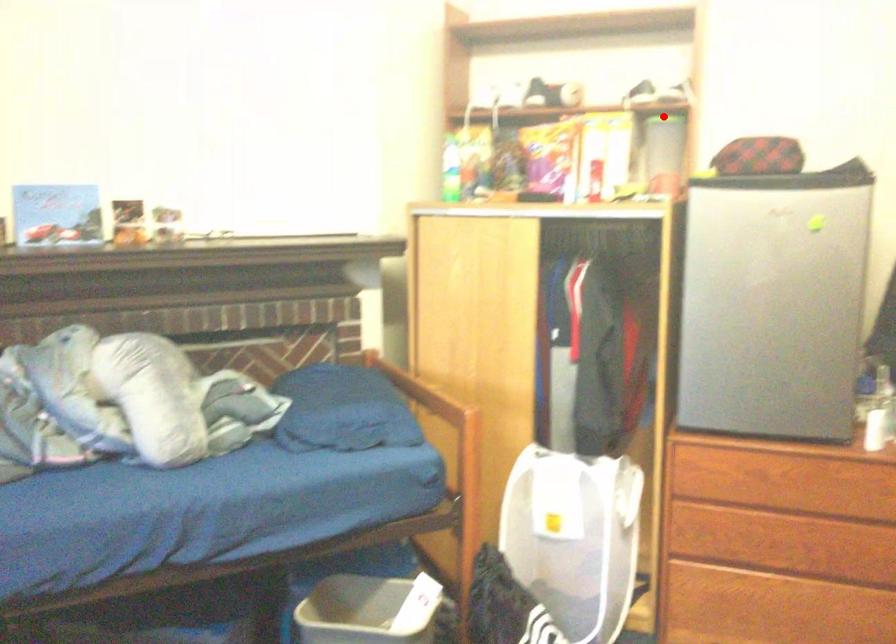
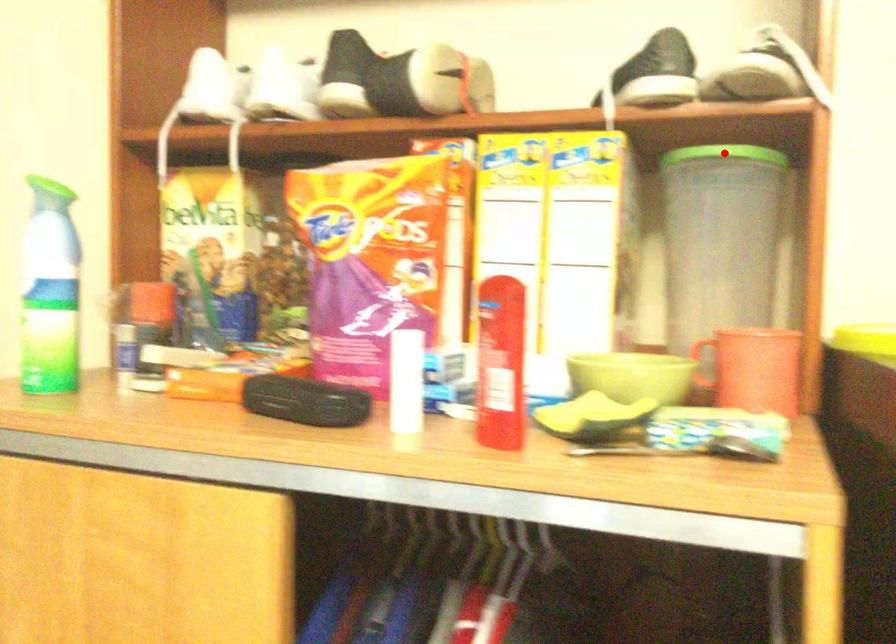
I am providing you with two images of the same scene from different viewpoints. A red point is marked on the first image and another point is marked on the second image. Are the points marked in image1 and image2 representing the same 3D position?

Yes